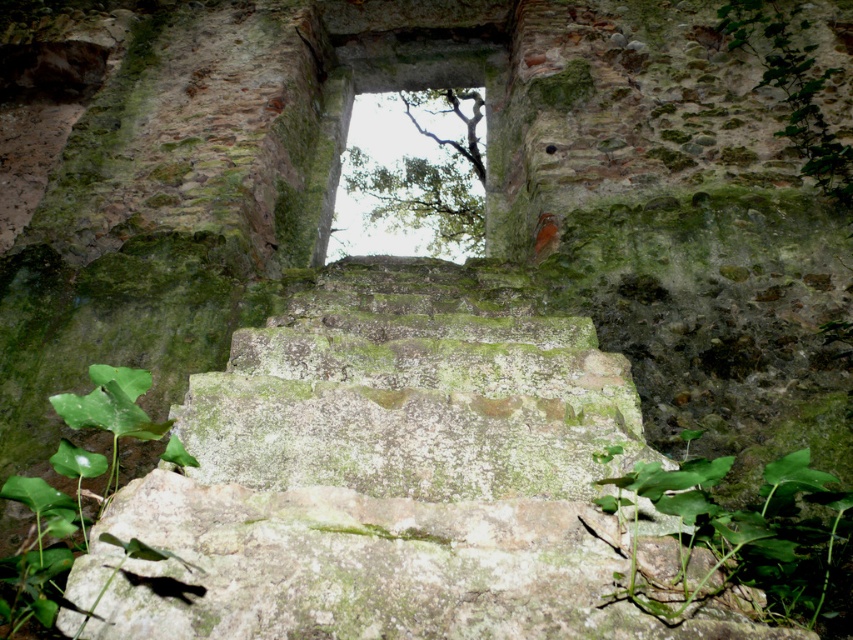
You are standing at the base of the ancient stone steps leading to the rectangular opening. You notice a point marked at coordinates (741, 531). What object is located at this point?

The point at coordinates (741, 531) indicates a green leafy plant at lower right.

You are an archaeologist examining the ancient stone structure. You notice the green leafy plant at lower right and the green leafy tree at upper center. Based on their positions, which one is closer to the ground?

The green leafy plant at lower right is closer to the ground since it is positioned below the green leafy tree at upper center.

From the picture: You are a hiker standing at the base of the ancient stone steps. You notice a green leafy plant at lower right and a green leafy tree at upper center. Which one appears closer to you?

The green leafy plant at lower right appears closer because it is in front of the green leafy tree at upper center.